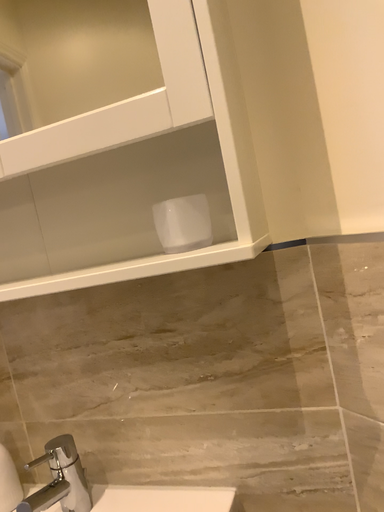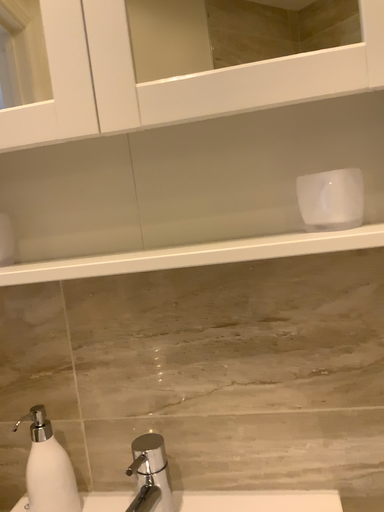
Question: Which way did the camera rotate in the video?

Choices:
 (A) rotated left
 (B) rotated right

Answer: (B)